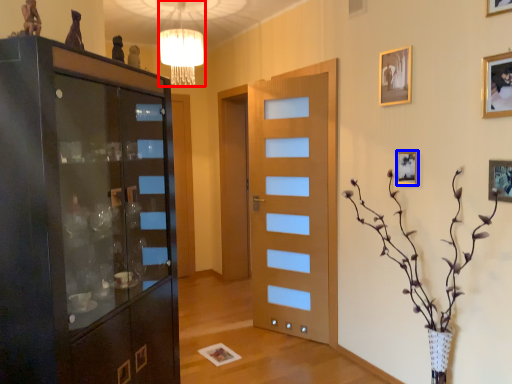
Question: Among these objects, which one is nearest to the camera, lamp (highlighted by a red box) or picture frame (highlighted by a blue box)?

Choices:
 (A) lamp
 (B) picture frame

Answer: (B)